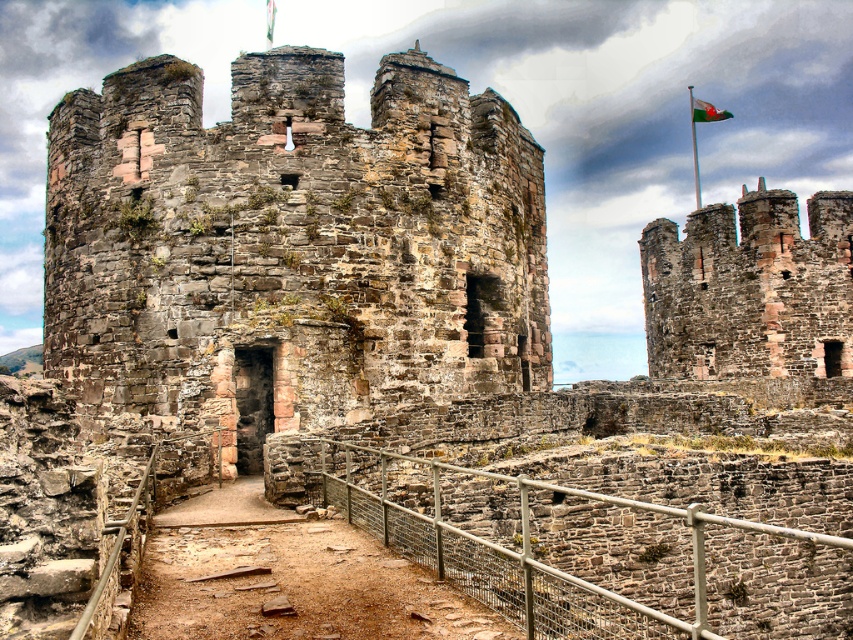
You are a historian standing at the base of the rusty stone castle at center. You want to reach the green fabric flag at upper right to study its design. Given that your average walking speed is 1.5 meters per second, how many seconds will it take you to walk directly to the flag?

The distance between the rusty stone castle at center and the green fabric flag at upper right is 117.39 meters. At a walking speed of 1.5 meters per second, it would take approximately 78.26 seconds to reach the flag.

You are a tourist standing in front of the rusty stone castle at center and the rustic stone wall at upper right. Which structure would appear larger to you?

The rusty stone castle at center appears larger because it is closer to the viewer than the rustic stone wall at upper right.

You are standing at the point marked by the coordinate point (750, 289) in the medieval castle ruins. Looking around, you see the rustic stone wall at upper right. Which direction should you face to see the Welsh flag flying atop the tower?

The rustic stone wall at upper right is represented by point (750, 289). Since the Welsh flag is atop one of the towers, you should face away from the wall towards the central tower to see the flag.